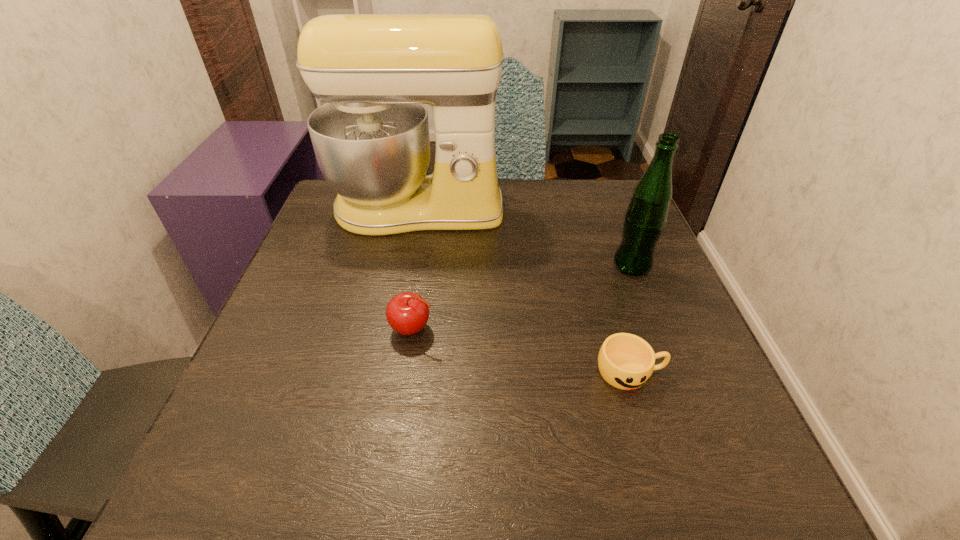
Find the location of a particular element. The width and height of the screenshot is (960, 540). the farthest object is located at coordinates (371, 139).

At what (x,y) coordinates should I click in order to perform the action: click on mixer. Please return your answer as a coordinate pair (x, y). Looking at the image, I should click on click(371, 139).

Image resolution: width=960 pixels, height=540 pixels. I want to click on the third nearest object, so click(646, 216).

Identify the location of the third shortest object. (646, 216).

Image resolution: width=960 pixels, height=540 pixels. Find the location of `the second nearest object`. the second nearest object is located at coordinates (407, 313).

What are the coordinates of `cherry` in the screenshot? It's located at (407, 313).

Where is `the shortest object`? the shortest object is located at coordinates (626, 361).

Image resolution: width=960 pixels, height=540 pixels. I want to click on the nearest object, so pyautogui.click(x=626, y=361).

Locate an element on the screen. vacant space located on the side of the tallest object with the control knob is located at coordinates (393, 347).

The image size is (960, 540). Find the location of `blank space located 0.060m on the front of the beer bottle`. blank space located 0.060m on the front of the beer bottle is located at coordinates (644, 298).